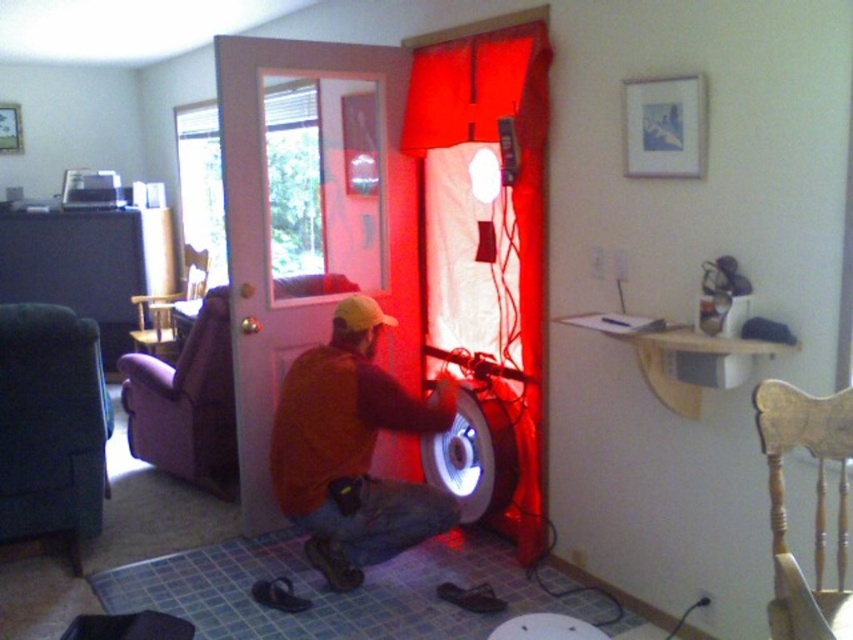
You are organizing a small event in the room and need to decide whether to place a 1.5 meter tall decoration between the brown suede jacket at center and the red fabric curtain at center. Based on their heights, will the decoration fit vertically between them?

The brown suede jacket at center is shorter than the red fabric curtain at center. Since the decoration is 1.5 meters tall, it may not fit vertically between them if the jacket is lower and the curtain is higher, potentially blocking the space.

You are a delivery person who needs to enter the room through the white glossy door at center. However, the red fabric curtain at center is partially covering the doorway. Can you walk through the door without moving the curtain?

The white glossy door at center is larger in size compared to the red fabric curtain at center, so yes, you can walk through the door without moving the curtain as the door is bigger and likely provides enough space to pass through.

You are standing in the room and want to exit through the white glossy door at center. However, the red fabric curtain at center is partially covering the doorway. Which object must you move to access the door?

You must move the red fabric curtain at center because the white glossy door at center is positioned on the left side of the red fabric curtain at center, meaning the curtain is blocking the door.